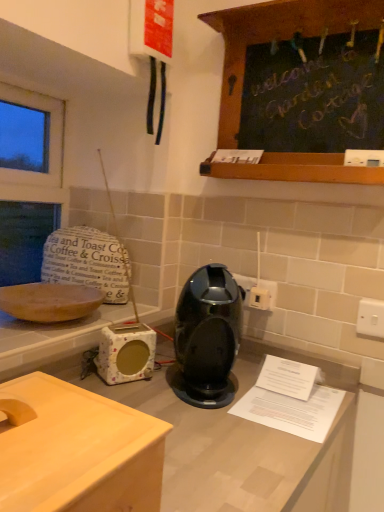
The image size is (384, 512). Find the location of `matte wooden bowl at left`. matte wooden bowl at left is located at coordinates (49, 301).

Locate an element on the screen. Image resolution: width=384 pixels, height=512 pixels. glossy plastic coffee machine at center is located at coordinates (207, 337).

What do you see at coordinates (258, 292) in the screenshot?
I see `white plastic electric outlet at center-right, arranged as the first electric outlet when viewed from the left` at bounding box center [258, 292].

In order to face white plastic electric outlet at center-right, arranged as the 2th electric outlet when viewed from the right, should I rotate leftwards or rightwards?

Turn right by 9.149 degrees to look at white plastic electric outlet at center-right, arranged as the 2th electric outlet when viewed from the right.

What do you see at coordinates (370, 318) in the screenshot? I see `white plastic switch at right, the 3th electric outlet in the left-to-right sequence` at bounding box center [370, 318].

Where is `matte wooden countertop at center`? The image size is (384, 512). matte wooden countertop at center is located at coordinates (78, 451).

From the picture: Can you confirm if glossy plastic coffee machine at center is shorter than floral-patterned ceramic toaster at lower left?

In fact, glossy plastic coffee machine at center may be taller than floral-patterned ceramic toaster at lower left.

Is point (205, 285) closer or farther from the camera than point (122, 326)?

Point (205, 285) is positioned closer to the camera compared to point (122, 326).

Considering the sizes of objects glossy plastic coffee machine at center and floral-patterned ceramic toaster at lower left in the image provided, who is smaller, glossy plastic coffee machine at center or floral-patterned ceramic toaster at lower left?

Smaller between the two is floral-patterned ceramic toaster at lower left.

Is glossy plastic coffee machine at center not inside floral-patterned ceramic toaster at lower left?

That's correct, glossy plastic coffee machine at center is outside of floral-patterned ceramic toaster at lower left.

How distant is glossy plastic coffee machine at center from white plastic electric outlet at center-right, marked as the 2th electric outlet in a front-to-back arrangement?

glossy plastic coffee machine at center is 11.56 inches away from white plastic electric outlet at center-right, marked as the 2th electric outlet in a front-to-back arrangement.

Considering the relative positions of glossy plastic coffee machine at center and white plastic electric outlet at center-right, positioned as the second electric outlet in left-to-right order, in the image provided, is glossy plastic coffee machine at center to the right of white plastic electric outlet at center-right, positioned as the second electric outlet in left-to-right order, from the viewer's perspective?

No.

Can you tell me how much glossy plastic coffee machine at center and white plastic electric outlet at center-right, arranged as the 2th electric outlet when viewed from the right, differ in facing direction?

36.7 degrees separate the facing orientations of glossy plastic coffee machine at center and white plastic electric outlet at center-right, arranged as the 2th electric outlet when viewed from the right.

Is glossy plastic coffee machine at center far away from white plastic electric outlet at center-right, arranged as the 2th electric outlet when viewed from the right?

No, glossy plastic coffee machine at center is not far away from white plastic electric outlet at center-right, arranged as the 2th electric outlet when viewed from the right.

From the picture: Is white plastic electric outlet at center-right, arranged as the 2th electric outlet when viewed from the right, smaller than white plastic switch at right, arranged as the 3th electric outlet when viewed from the back?

No.

Considering the relative positions of white plastic electric outlet at center-right, marked as the 2th electric outlet in a front-to-back arrangement, and white plastic switch at right, the 3th electric outlet in the left-to-right sequence, in the image provided, is white plastic electric outlet at center-right, marked as the 2th electric outlet in a front-to-back arrangement, to the right of white plastic switch at right, the 3th electric outlet in the left-to-right sequence, from the viewer's perspective?

No, white plastic electric outlet at center-right, marked as the 2th electric outlet in a front-to-back arrangement, is not to the right of white plastic switch at right, the 3th electric outlet in the left-to-right sequence.

From a real-world perspective, which is physically above, white plastic electric outlet at center-right, which appears as the second electric outlet when viewed from the back, or white plastic switch at right, arranged as the 3th electric outlet when viewed from the back?

In real-world perspective, white plastic electric outlet at center-right, which appears as the second electric outlet when viewed from the back, is above.

Which of these two, white plastic electric outlet at center-right, positioned as the second electric outlet in left-to-right order, or white plastic electric outlet at center-right, which is the 1th electric outlet from back to front, stands shorter?

With less height is white plastic electric outlet at center-right, positioned as the second electric outlet in left-to-right order.

Does white plastic electric outlet at center-right, marked as the 2th electric outlet in a front-to-back arrangement, lie behind white plastic electric outlet at center-right, arranged as the first electric outlet when viewed from the left?

No, it is in front of white plastic electric outlet at center-right, arranged as the first electric outlet when viewed from the left.

Is white plastic electric outlet at center-right, arranged as the 2th electric outlet when viewed from the right, facing towards white plastic electric outlet at center-right, which is the 1th electric outlet from back to front?

No.

Who is more distant, white plastic switch at right, the first electric outlet when ordered from front to back, or matte wooden bowl at left?

white plastic switch at right, the first electric outlet when ordered from front to back.

Is white plastic switch at right, the first electric outlet when ordered from front to back, positioned beyond the bounds of matte wooden bowl at left?

Yes, white plastic switch at right, the first electric outlet when ordered from front to back, is located beyond the bounds of matte wooden bowl at left.

Which is more to the right, white plastic switch at right, the 3th electric outlet in the left-to-right sequence, or matte wooden bowl at left?

white plastic switch at right, the 3th electric outlet in the left-to-right sequence, is more to the right.

How many degrees apart are the facing directions of white plastic switch at right, the 3th electric outlet in the left-to-right sequence, and floral-patterned ceramic toaster at lower left?

63.4 degrees separate the facing orientations of white plastic switch at right, the 3th electric outlet in the left-to-right sequence, and floral-patterned ceramic toaster at lower left.

Which of these two, white plastic switch at right, which is the first electric outlet in right-to-left order, or floral-patterned ceramic toaster at lower left, is bigger?

floral-patterned ceramic toaster at lower left is bigger.

Considering the positions of objects white plastic switch at right, the first electric outlet when ordered from front to back, and floral-patterned ceramic toaster at lower left in the image provided, who is more to the left, white plastic switch at right, the first electric outlet when ordered from front to back, or floral-patterned ceramic toaster at lower left?

floral-patterned ceramic toaster at lower left is more to the left.

Based on the photo, is floral-patterned ceramic toaster at lower left inside white plastic switch at right, the first electric outlet when ordered from front to back?

No, floral-patterned ceramic toaster at lower left is not a part of white plastic switch at right, the first electric outlet when ordered from front to back.

Between floral-patterned ceramic toaster at lower left and matte wooden countertop at center, which one has larger size?

matte wooden countertop at center is bigger.

From the image's perspective, is floral-patterned ceramic toaster at lower left located above or below matte wooden countertop at center?

Based on their image positions, floral-patterned ceramic toaster at lower left is located above matte wooden countertop at center.

Between point (126, 371) and point (160, 499), which one is positioned in front?

The point (160, 499) is more forward.

Can you confirm if floral-patterned ceramic toaster at lower left is positioned to the right of matte wooden countertop at center?

Indeed, floral-patterned ceramic toaster at lower left is positioned on the right side of matte wooden countertop at center.

You are a GUI agent. You are given a task and a screenshot of the screen. Output one action in this format:
    pyautogui.click(x=<x>, y=<y>)
    Task: Click on the appliance lying behind the glossy plastic coffee machine at center
    This screenshot has width=384, height=512.
    Given the screenshot: What is the action you would take?
    pyautogui.click(x=126, y=353)

You are a GUI agent. You are given a task and a screenshot of the screen. Output one action in this format:
    pyautogui.click(x=<x>, y=<y>)
    Task: Click on the electric outlet that is the 2nd object above the glossy plastic coffee machine at center (from a real-world perspective)
    The height and width of the screenshot is (512, 384).
    Given the screenshot: What is the action you would take?
    pyautogui.click(x=259, y=298)

When comparing their distances from matte wooden countertop at center, does black wood chalkboard at upper right or white plastic switch at right, which is the first electric outlet in right-to-left order, seem further?

black wood chalkboard at upper right is positioned further to the anchor matte wooden countertop at center.

Looking at the image, which one is located further to black wood chalkboard at upper right, glossy plastic coffee machine at center or white plastic electric outlet at center-right, which appears as the second electric outlet when viewed from the back?

Among the two, white plastic electric outlet at center-right, which appears as the second electric outlet when viewed from the back, is located further to black wood chalkboard at upper right.

Based on their spatial positions, is matte wooden countertop at center or white plastic switch at right, the first electric outlet when ordered from front to back, closer to floral-patterned ceramic toaster at lower left?

Among the two, matte wooden countertop at center is located nearer to floral-patterned ceramic toaster at lower left.

From the image, which object appears to be nearer to matte wooden bowl at left, white plastic electric outlet at center-right, which appears as the second electric outlet when viewed from the back, or white plastic switch at right, the first electric outlet when ordered from front to back?

white plastic electric outlet at center-right, which appears as the second electric outlet when viewed from the back.

Looking at the image, which one is located closer to matte wooden countertop at center, white plastic switch at right, which is the first electric outlet in right-to-left order, or matte wooden bowl at left?

matte wooden bowl at left lies closer to matte wooden countertop at center than the other object.

Based on the photo, considering their positions, is white plastic switch at right, the 3th electric outlet in the left-to-right sequence, positioned closer to white plastic electric outlet at center-right, the third electric outlet when ordered from right to left, than black wood chalkboard at upper right?

white plastic switch at right, the 3th electric outlet in the left-to-right sequence.

Looking at the image, which one is located further to matte wooden bowl at left, white plastic electric outlet at center-right, which appears as the second electric outlet when viewed from the back, or glossy plastic coffee machine at center?

Based on the image, white plastic electric outlet at center-right, which appears as the second electric outlet when viewed from the back, appears to be further to matte wooden bowl at left.

When comparing their distances from black wood chalkboard at upper right, does white plastic electric outlet at center-right, arranged as the first electric outlet when viewed from the left, or glossy plastic coffee machine at center seem further?

Based on the image, white plastic electric outlet at center-right, arranged as the first electric outlet when viewed from the left, appears to be further to black wood chalkboard at upper right.

Identify the location of electric outlet between matte wooden bowl at left and white plastic electric outlet at center-right, arranged as the 2th electric outlet when viewed from the right, in the horizontal direction. [x=258, y=292].

The image size is (384, 512). Find the location of `cabinetry located between matte wooden countertop at center and white plastic switch at right, arranged as the 3th electric outlet when viewed from the back, in the depth direction`. cabinetry located between matte wooden countertop at center and white plastic switch at right, arranged as the 3th electric outlet when viewed from the back, in the depth direction is located at coordinates (276, 39).

Locate an element on the screen. home appliance between matte wooden bowl at left and white plastic electric outlet at center-right, the third electric outlet when ordered from right to left, from left to right is located at coordinates (207, 337).

Find the location of a particular element. The image size is (384, 512). appliance situated between matte wooden bowl at left and glossy plastic coffee machine at center from left to right is located at coordinates (126, 353).